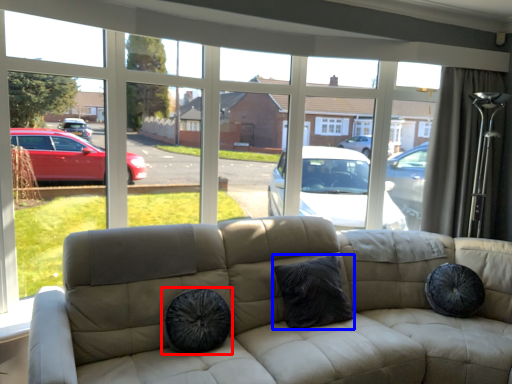
Question: Which object is further to the camera taking this photo, dog bed (highlighted by a red box) or pillow (highlighted by a blue box)?

Choices:
 (A) dog bed
 (B) pillow

Answer: (B)